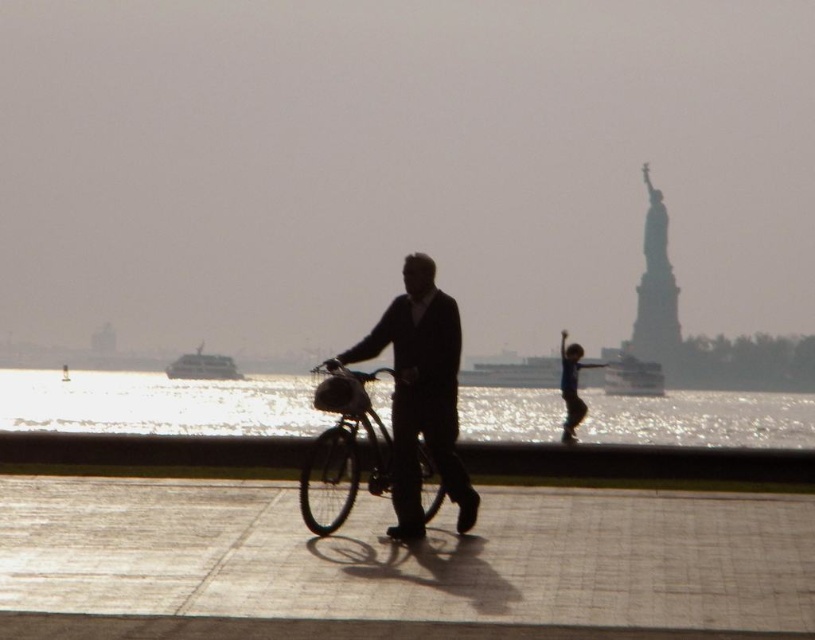
You are planning to ride the metallic silver bicycle at center along the smooth concrete sidewalk at center. Based on the scene description, can the bicycle fit comfortably on the sidewalk?

The smooth concrete sidewalk at center is wider than the metallic silver bicycle at center, so the bicycle can fit comfortably on the sidewalk.

You are standing on the smooth concrete sidewalk at center and want to reach the metallic silver bicycle at center. Which direction should you move to get there?

Since the smooth concrete sidewalk at center is to the right of the metallic silver bicycle at center, you should move to your left to reach the metallic silver bicycle at center.

Consider the image. You are standing on the walkway and want to greet the person wearing the dark suit at center and the blue fabric shirt at center. Which one should you approach first if you are facing the water?

You should approach the dark suit at center first because it is to the left of the blue fabric shirt at center, meaning it is closer to your right side when facing the water.